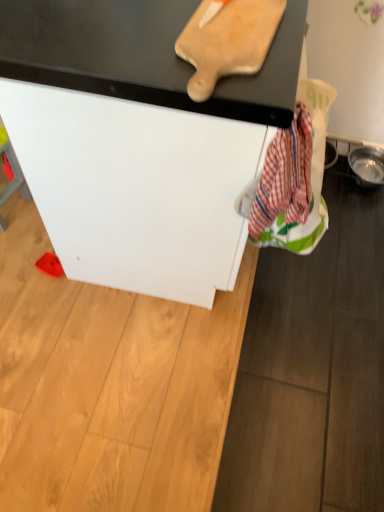
The width and height of the screenshot is (384, 512). What are the coordinates of `free space to the left of wooden cutting board at upper center` in the screenshot? It's located at (112, 36).